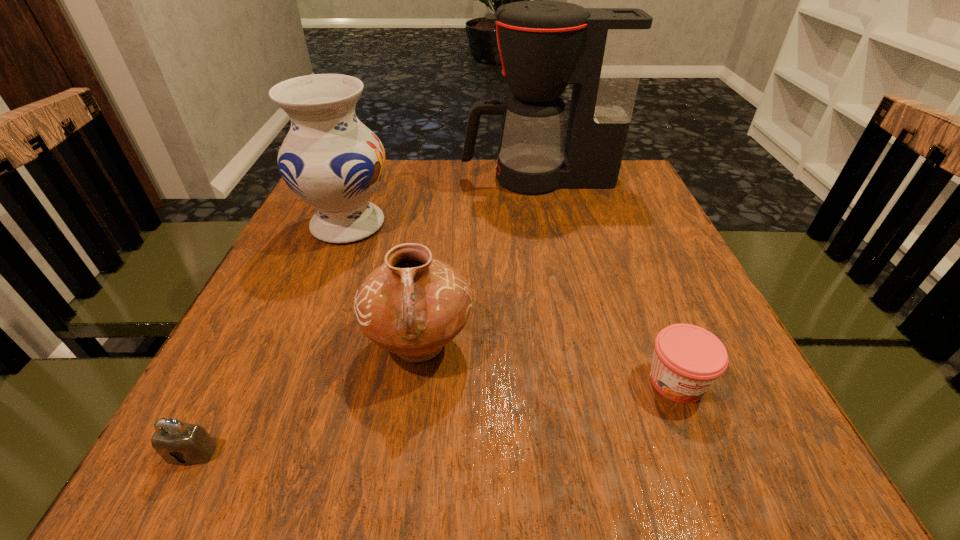
I want to click on free space located on the front of the second tallest object, so click(x=308, y=325).

The width and height of the screenshot is (960, 540). I want to click on free space located on the side of the third tallest object with the handle, so click(401, 480).

At what (x,y) coordinates should I click in order to perform the action: click on blank area located on the front label of the jam. Please return your answer as a coordinate pair (x, y). Image resolution: width=960 pixels, height=540 pixels. Looking at the image, I should click on (701, 442).

What are the coordinates of `coffee maker that is at the far edge` in the screenshot? It's located at (544, 45).

The height and width of the screenshot is (540, 960). Find the location of `vase present at the far edge`. vase present at the far edge is located at coordinates (333, 162).

Locate an element on the screen. This screenshot has width=960, height=540. object located in the near edge section of the desktop is located at coordinates (179, 443).

Where is `vase situated at the left edge`? vase situated at the left edge is located at coordinates (333, 162).

This screenshot has width=960, height=540. In order to click on padlock that is positioned at the left edge in this screenshot , I will do `click(179, 443)`.

Where is `coffee maker that is at the right edge`? The image size is (960, 540). coffee maker that is at the right edge is located at coordinates (544, 45).

This screenshot has width=960, height=540. What are the coordinates of `jam located in the right edge section of the desktop` in the screenshot? It's located at (687, 360).